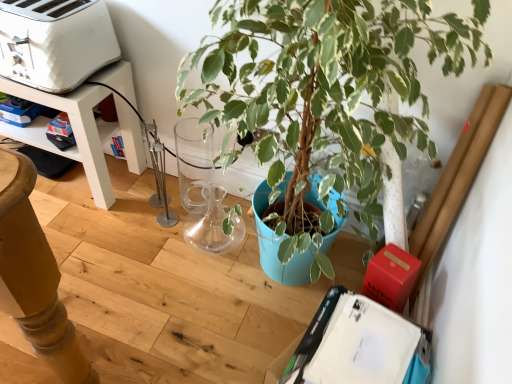
What is the approximate height of white plastic toaster at upper left?

The height of white plastic toaster at upper left is 5.18 inches.

This screenshot has width=512, height=384. Describe the element at coordinates (55, 42) in the screenshot. I see `white plastic toaster at upper left` at that location.

The image size is (512, 384). I want to click on white plastic toaster at upper left, so click(x=55, y=42).

This screenshot has width=512, height=384. Describe the element at coordinates (326, 91) in the screenshot. I see `green variegated leaf at center` at that location.

Identify the location of green variegated leaf at center. The height and width of the screenshot is (384, 512). (326, 91).

What is the approximate width of green variegated leaf at center?

It is 19.37 inches.

Locate an element on the screen. The width and height of the screenshot is (512, 384). white plastic toaster at upper left is located at coordinates (55, 42).

Is white plastic toaster at upper left to the left or to the right of green variegated leaf at center in the image?

Based on their positions, white plastic toaster at upper left is located to the left of green variegated leaf at center.

Which object is further away from the camera, white plastic toaster at upper left or green variegated leaf at center?

white plastic toaster at upper left is further from the camera.

Is point (110, 42) behind point (326, 60)?

That is True.

From the image's perspective, is white plastic toaster at upper left beneath green variegated leaf at center?

Incorrect, from the image's perspective, white plastic toaster at upper left is higher than green variegated leaf at center.

From a real-world perspective, is white plastic toaster at upper left on green variegated leaf at center?

Correct, in the physical world, white plastic toaster at upper left is higher than green variegated leaf at center.

Does white plastic toaster at upper left have a lesser width compared to green variegated leaf at center?

Indeed, white plastic toaster at upper left has a lesser width compared to green variegated leaf at center.

Can you confirm if white plastic toaster at upper left is taller than green variegated leaf at center?

No.

Looking at this image, considering the sizes of objects white plastic toaster at upper left and green variegated leaf at center in the image provided, who is smaller, white plastic toaster at upper left or green variegated leaf at center?

white plastic toaster at upper left is smaller.

Is green variegated leaf at center inside white plastic toaster at upper left?

No, green variegated leaf at center is not a part of white plastic toaster at upper left.

From the picture: Is white plastic toaster at upper left not close to green variegated leaf at center?

white plastic toaster at upper left is near green variegated leaf at center, not far away.

Consider the image. Is white plastic toaster at upper left facing away from green variegated leaf at center?

white plastic toaster at upper left is not turned away from green variegated leaf at center.

How many degrees apart are the facing directions of white plastic toaster at upper left and green variegated leaf at center?

3.68 degrees.

How far apart are white plastic toaster at upper left and green variegated leaf at center?

They are 23.83 inches apart.

Identify the location of appliance above the green variegated leaf at center (from a real-world perspective). (55, 42).

Between green variegated leaf at center and white plastic toaster at upper left, which one appears on the left side from the viewer's perspective?

white plastic toaster at upper left is more to the left.

Which object is closer to the camera taking this photo, green variegated leaf at center or white plastic toaster at upper left?

Positioned in front is green variegated leaf at center.

Considering the points (277, 194) and (59, 77), which point is behind, point (277, 194) or point (59, 77)?

The point (59, 77) is farther from the camera.

From the image's perspective, which object appears higher, green variegated leaf at center or white plastic toaster at upper left?

From the image's view, white plastic toaster at upper left is above.

From a real-world perspective, does green variegated leaf at center stand above white plastic toaster at upper left?

Incorrect, from a real-world perspective, green variegated leaf at center is lower than white plastic toaster at upper left.

Between green variegated leaf at center and white plastic toaster at upper left, which one has smaller width?

white plastic toaster at upper left is thinner.

Which of these two, green variegated leaf at center or white plastic toaster at upper left, stands shorter?

Standing shorter between the two is white plastic toaster at upper left.

Who is smaller, green variegated leaf at center or white plastic toaster at upper left?

With smaller size is white plastic toaster at upper left.

Is green variegated leaf at center situated inside white plastic toaster at upper left or outside?

The correct answer is: outside.

Is green variegated leaf at center far from white plastic toaster at upper left?

That's not correct — green variegated leaf at center is a little close to white plastic toaster at upper left.

Is green variegated leaf at center facing away from white plastic toaster at upper left?

No, green variegated leaf at center's orientation is not away from white plastic toaster at upper left.

From the picture: What's the angular difference between green variegated leaf at center and white plastic toaster at upper left's facing directions?

The facing directions of green variegated leaf at center and white plastic toaster at upper left are 3.68 degrees apart.

You are a GUI agent. You are given a task and a screenshot of the screen. Output one action in this format:
    pyautogui.click(x=<x>, y=<y>)
    Task: Click on the houseplant in front of the white plastic toaster at upper left
    
    Given the screenshot: What is the action you would take?
    pyautogui.click(x=326, y=91)

Where is `appliance on the left of green variegated leaf at center`? Image resolution: width=512 pixels, height=384 pixels. appliance on the left of green variegated leaf at center is located at coordinates (55, 42).

Where is `appliance above the green variegated leaf at center (from the image's perspective)`? This screenshot has width=512, height=384. appliance above the green variegated leaf at center (from the image's perspective) is located at coordinates (55, 42).